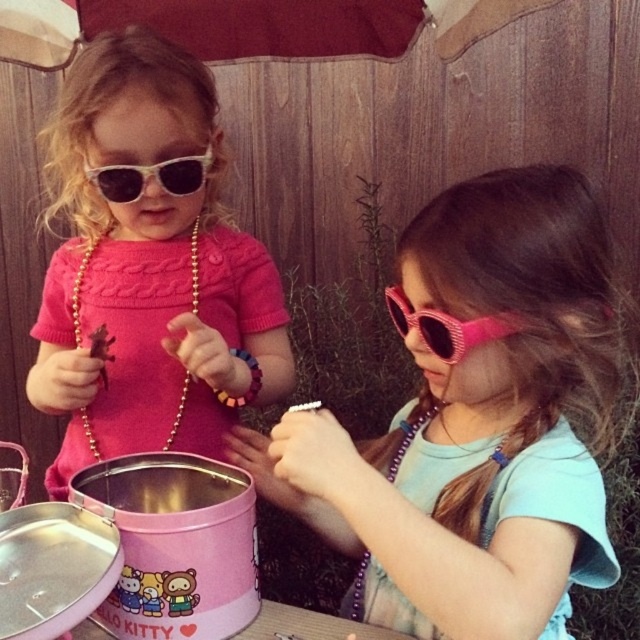
Question: Does matte pink sweater at left have a lesser width compared to white plastic sunglasses at upper left?

Choices:
 (A) no
 (B) yes

Answer: (A)

Question: Among these objects, which one is farthest from the camera?

Choices:
 (A) pink matte sunglasses at center
 (B) white plastic sunglasses at upper left
 (C) matte pink sweater at left
 (D) pink glittery sunglasses at right

Answer: (B)

Question: From the image, what is the correct spatial relationship of pink matte sunglasses at center in relation to matte pink sweater at left?

Choices:
 (A) below
 (B) above

Answer: (A)

Question: Does pink matte sunglasses at center appear under white plastic sunglasses at upper left?

Choices:
 (A) yes
 (B) no

Answer: (A)

Question: Which of these objects is positioned farthest from the matte pink sweater at left?

Choices:
 (A) pink glittery sunglasses at right
 (B) pink matte sunglasses at center
 (C) white plastic sunglasses at upper left

Answer: (A)

Question: Which of the following is the farthest from the observer?

Choices:
 (A) (477, 326)
 (B) (104, 192)
 (C) (156, 148)

Answer: (B)